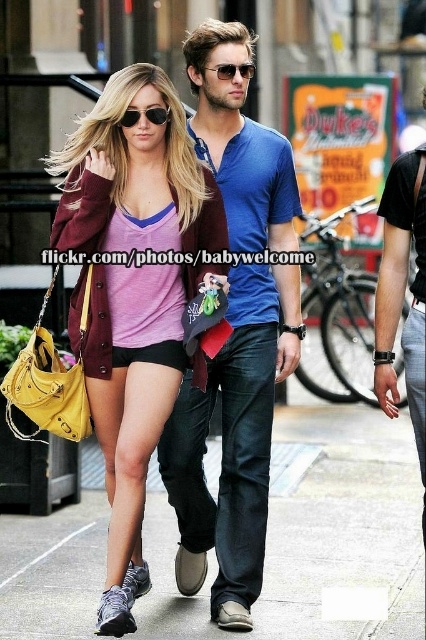
You are a pedestrian standing at the point [374,580] and want to cross the street to reach the other side. The nearest crosswalk is 30 meters away. Can you safely reach the crosswalk before the traffic light turns red in 10 seconds?

The nearest crosswalk is 30 meters away, and you are at point [374,580]. Since you need to cover 30 meters in 10 seconds, your required speed is 3 m per second. A safe walking speed for pedestrians is typically around 1.4 m per second. Therefore, it is not safe to reach the crosswalk in time before the traffic light turns red.